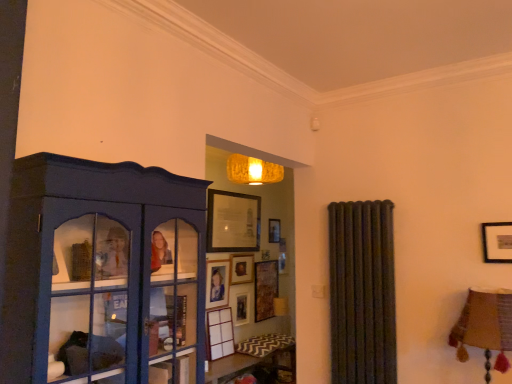
Question: Does point (138, 258) appear closer or farther from the camera than point (207, 210)?

Choices:
 (A) closer
 (B) farther

Answer: (A)

Question: Looking at the image, does matte blue cabinet at left seem bigger or smaller compared to wooden picture frame at upper center, which ranks as the 5th picture frame in bottom-to-top order?

Choices:
 (A) big
 (B) small

Answer: (A)

Question: Based on their relative distances, which object is nearer to the wooden picture frame at center, which is counted as the second picture frame, starting from the top?

Choices:
 (A) wooden picture frame at upper center, arranged as the first picture frame when viewed from the top
 (B) matte blue cabinet at left
 (C) white matte picture frame at center, positioned as the 1th picture frame in bottom-to-top order
 (D) matte black picture frame at center, the third picture frame viewed from the top
 (E) wooden picture frame at center, arranged as the fourth picture frame when viewed from the top

Answer: (D)

Question: Estimate the real-world distances between objects in this image. Which object is farther from the wooden picture frame at center, arranged as the fourth picture frame when viewed from the top?

Choices:
 (A) matte blue cabinet at left
 (B) matte black picture frame at center, the third picture frame viewed from the top
 (C) wooden picture frame at upper center, arranged as the first picture frame when viewed from the top
 (D) wooden picture frame at center, the 4th picture frame positioned from the bottom
 (E) white matte picture frame at center, positioned as the 1th picture frame in bottom-to-top order

Answer: (A)